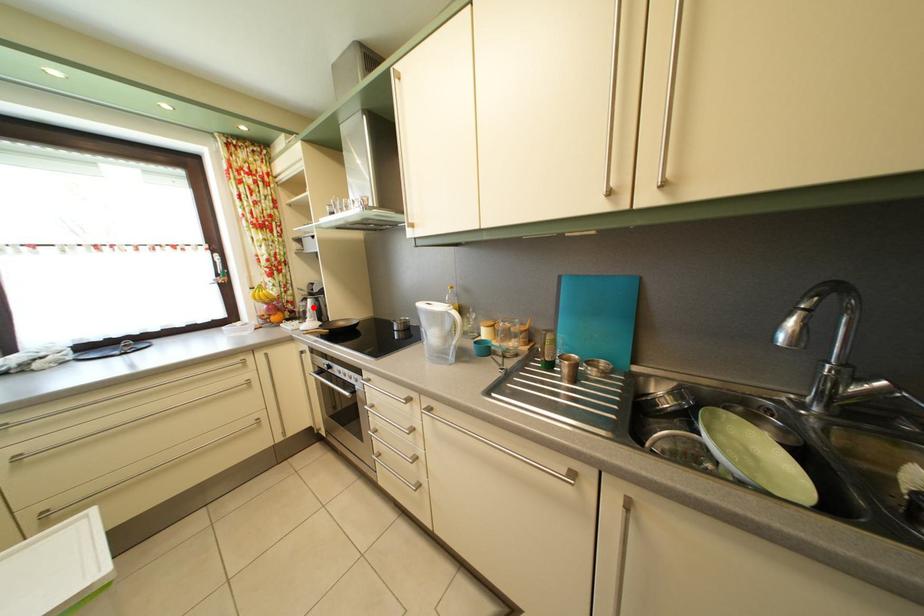
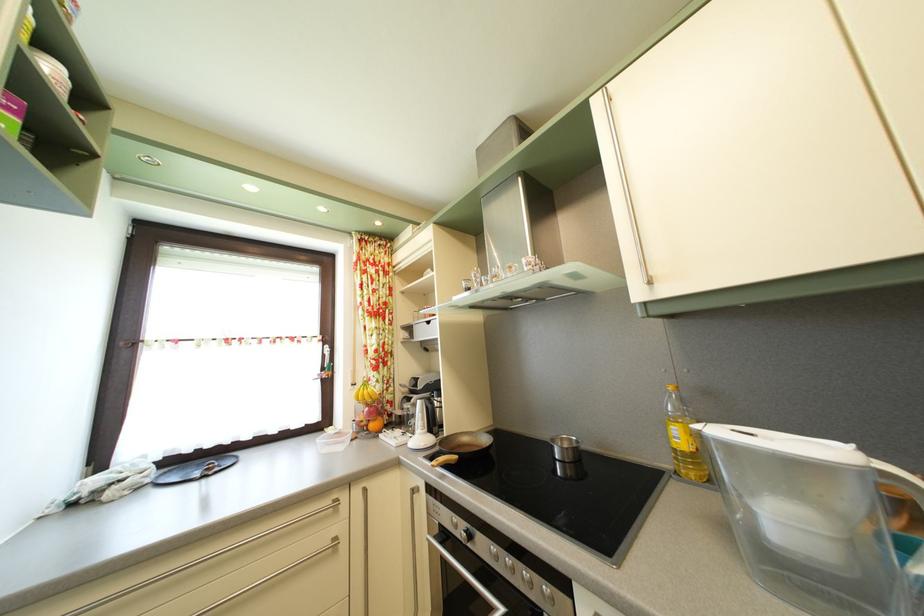
Question: I am providing you with two images of the same scene from different viewpoints. A red point is shown in image1. For the corresponding object point in image2, is it positioned nearer or farther from the camera?

Choices:
 (A) Nearer
 (B) Farther

Answer: (B)